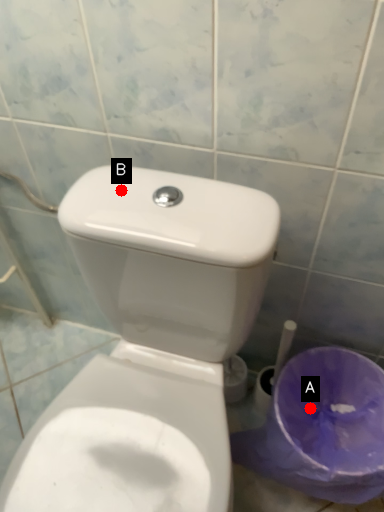
Question: Two points are circled on the image, labeled by A and B beside each circle. Which point appears closest to the camera in this image?

Choices:
 (A) A is closer
 (B) B is closer

Answer: (B)